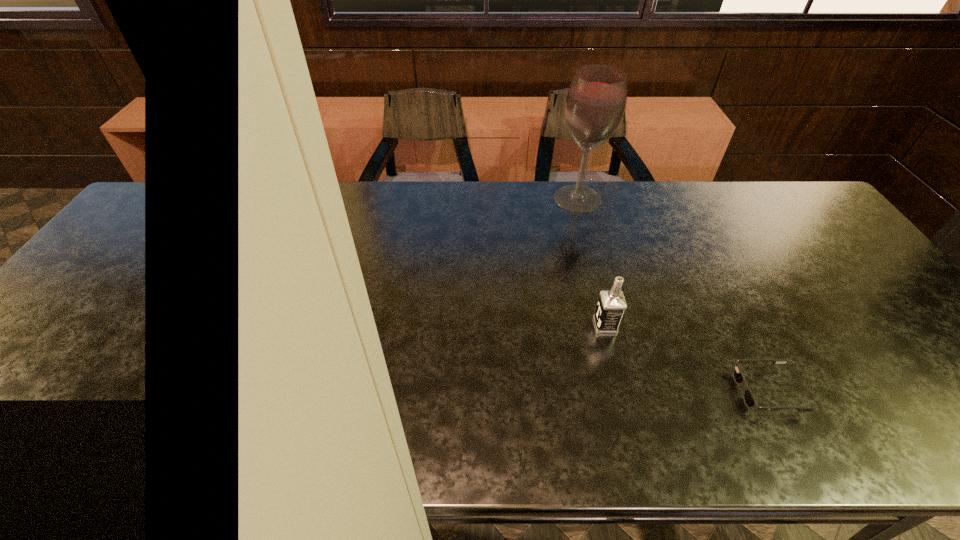
The height and width of the screenshot is (540, 960). I want to click on free space between the tallest object and the second farthest object, so click(591, 262).

Where is `free space between the second farthest object and the farthest object`? This screenshot has height=540, width=960. free space between the second farthest object and the farthest object is located at coordinates (591, 262).

Where is `free space between the alcohol and the second tallest object`? Image resolution: width=960 pixels, height=540 pixels. free space between the alcohol and the second tallest object is located at coordinates (591, 262).

Identify the location of free space between the alcohol and the shortest object. (672, 295).

Locate an element on the screen. blank region between the farthest object and the sunglasses is located at coordinates (672, 295).

Choose which object is the nearest neighbor to the sunglasses. Please provide its 2D coordinates. Your answer should be formatted as a tuple, i.e. [(x, y)], where the tuple contains the x and y coordinates of a point satisfying the conditions above.

[(611, 305)]

At what (x,y) coordinates should I click in order to perform the action: click on object that is the nearest to the rightmost object. Please return your answer as a coordinate pair (x, y). The width and height of the screenshot is (960, 540). Looking at the image, I should click on (611, 305).